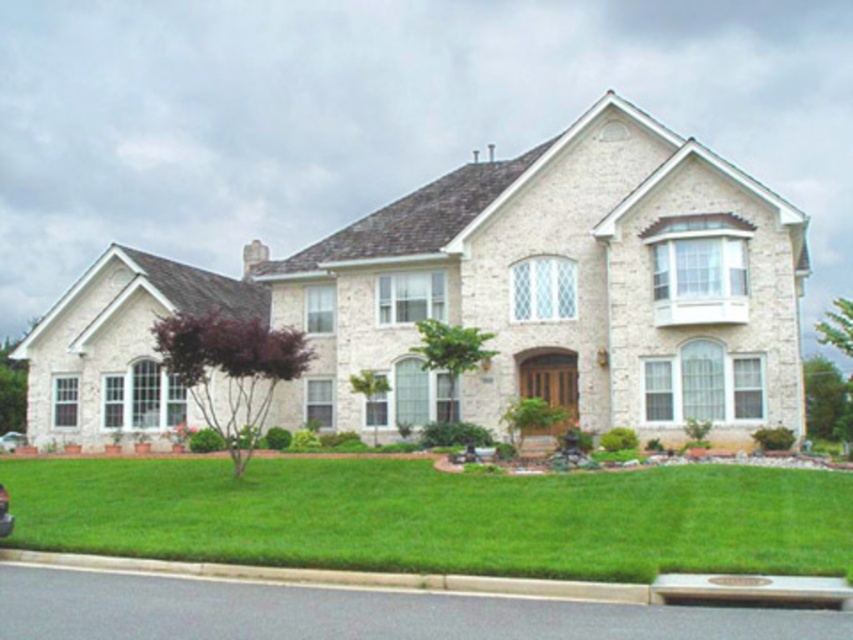
Is gray concrete curb at lower center positioned in front of shiny black car at lower left?

Yes.

Can you confirm if gray concrete curb at lower center is positioned to the right of shiny black car at lower left?

Yes, gray concrete curb at lower center is to the right of shiny black car at lower left.

Between point (119, 570) and point (3, 499), which one is positioned behind?

Point (3, 499)

Identify the location of gray concrete curb at lower center. This screenshot has width=853, height=640. (488, 580).

Is green grass at lower center above gray concrete curb at lower center?

Yes, green grass at lower center is above gray concrete curb at lower center.

From the picture: Between green grass at lower center and gray concrete curb at lower center, which one is positioned lower?

gray concrete curb at lower center is below.

Is point (381, 508) in front of point (59, 560)?

No, (381, 508) is further to viewer.

Where is `green grass at lower center`? The height and width of the screenshot is (640, 853). green grass at lower center is located at coordinates (438, 515).

Is green grass at lower center above shiny black car at lower left?

Yes, green grass at lower center is above shiny black car at lower left.

The height and width of the screenshot is (640, 853). Identify the location of green grass at lower center. (438, 515).